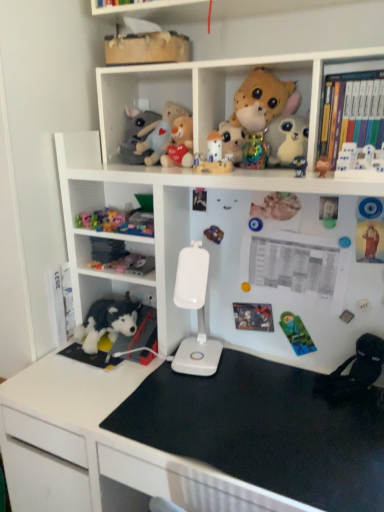
This screenshot has height=512, width=384. I want to click on empty space that is to the right of white plastic lamp at center, so click(x=252, y=372).